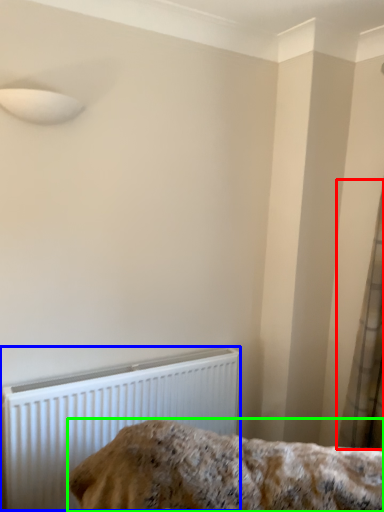
Question: Based on their relative distances, which object is nearer to curtain (highlighted by a red box)? Choose from radiator (highlighted by a blue box) and furniture (highlighted by a green box).

Choices:
 (A) radiator
 (B) furniture

Answer: (B)